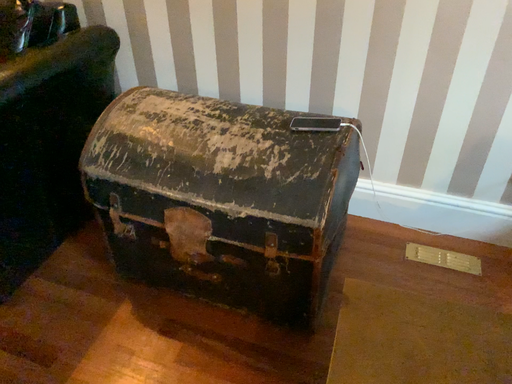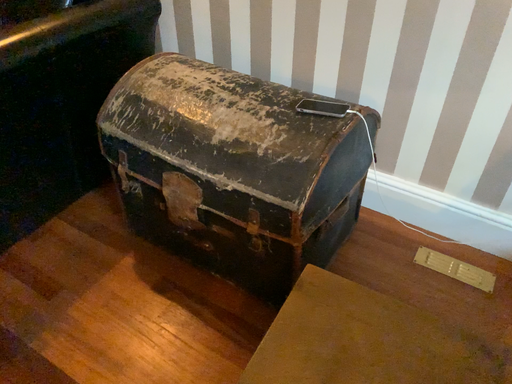
Question: Which way did the camera rotate in the video?

Choices:
 (A) rotated right
 (B) rotated left

Answer: (B)